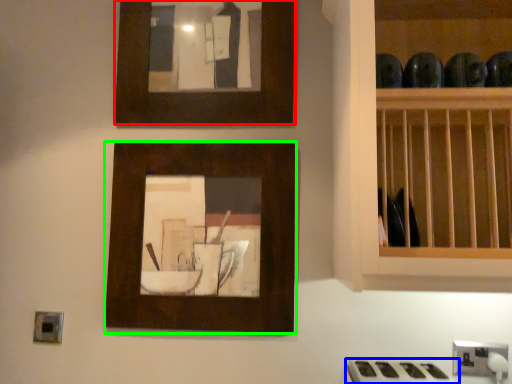
Question: Which object is positioned closest to picture frame (highlighted by a red box)? Select from gas stove (highlighted by a blue box) and picture frame (highlighted by a green box).

Choices:
 (A) gas stove
 (B) picture frame

Answer: (B)